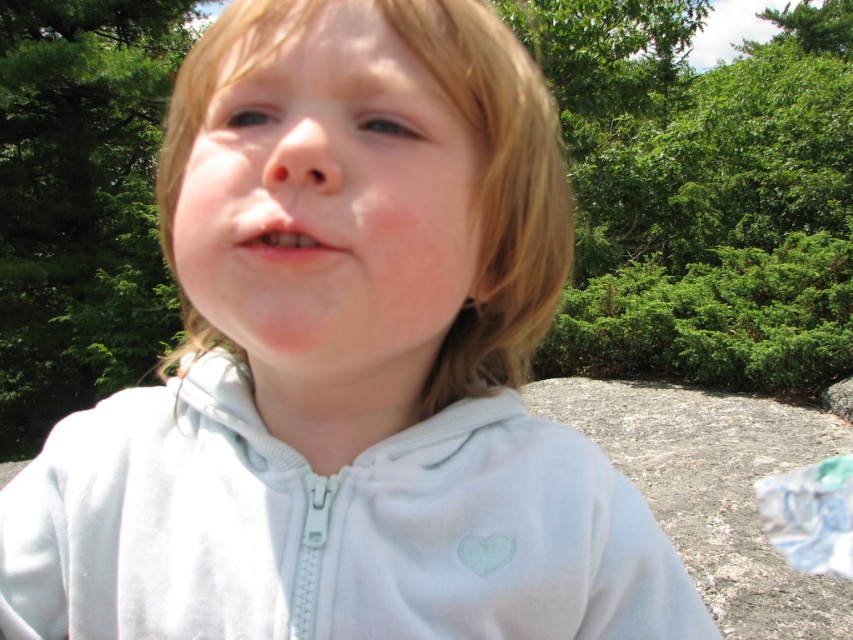
Question: Which object is farther from the camera taking this photo?

Choices:
 (A) light blue fleece sweatshirt at center
 (B) smooth skin face at center

Answer: (A)

Question: Can you confirm if light blue fleece sweatshirt at center is bigger than smooth skin face at center?

Choices:
 (A) yes
 (B) no

Answer: (B)

Question: Among these points, which one is nearest to the camera?

Choices:
 (A) (328, 252)
 (B) (79, 509)

Answer: (A)

Question: Is light blue fleece sweatshirt at center closer to camera compared to smooth skin face at center?

Choices:
 (A) no
 (B) yes

Answer: (A)

Question: Which is nearer to the light blue fleece sweatshirt at center?

Choices:
 (A) pink matte lips at center
 (B) smooth skin face at center

Answer: (B)

Question: Does light blue fleece sweatshirt at center have a smaller size compared to smooth skin face at center?

Choices:
 (A) yes
 (B) no

Answer: (A)